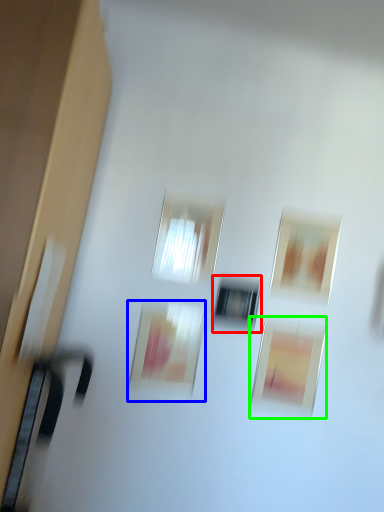
Question: Estimate the real-world distances between objects in this image. Which object is farther from window (highlighted by a red box), picture frame (highlighted by a blue box) or picture frame (highlighted by a green box)?

Choices:
 (A) picture frame
 (B) picture frame

Answer: (B)